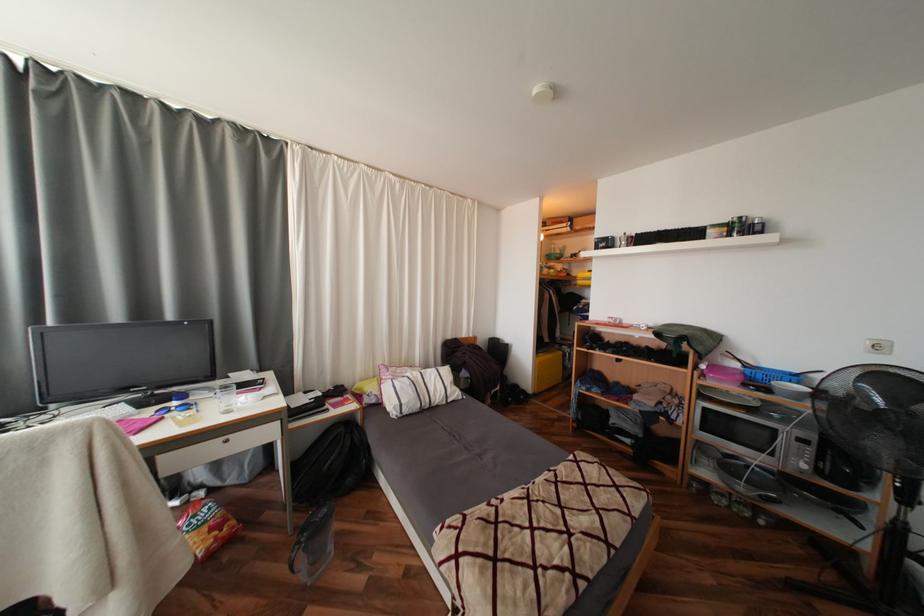
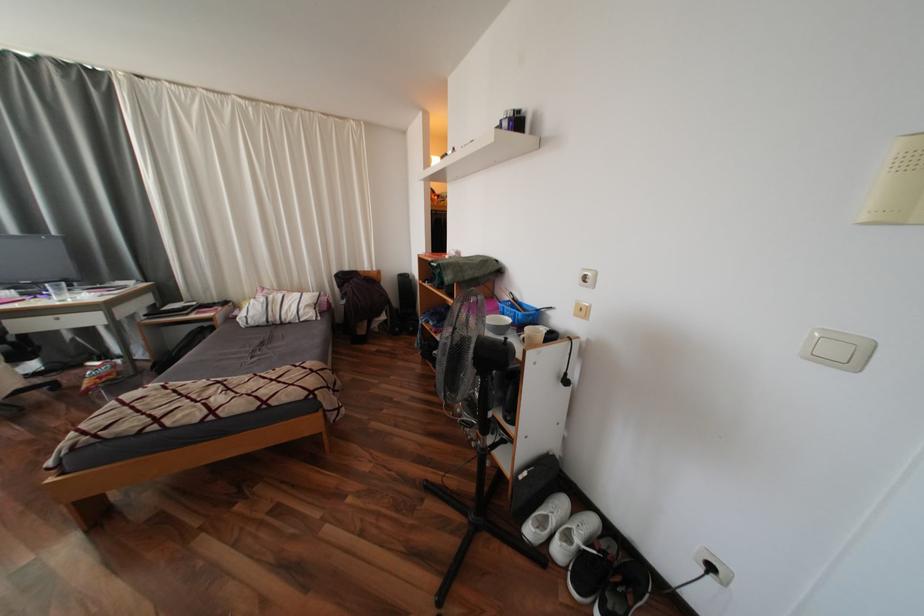
Question: In a continuous first-person perspective shot, in which direction is the camera moving?

Choices:
 (A) Left
 (B) Right
 (C) Forward
 (D) Backward

Answer: (B)